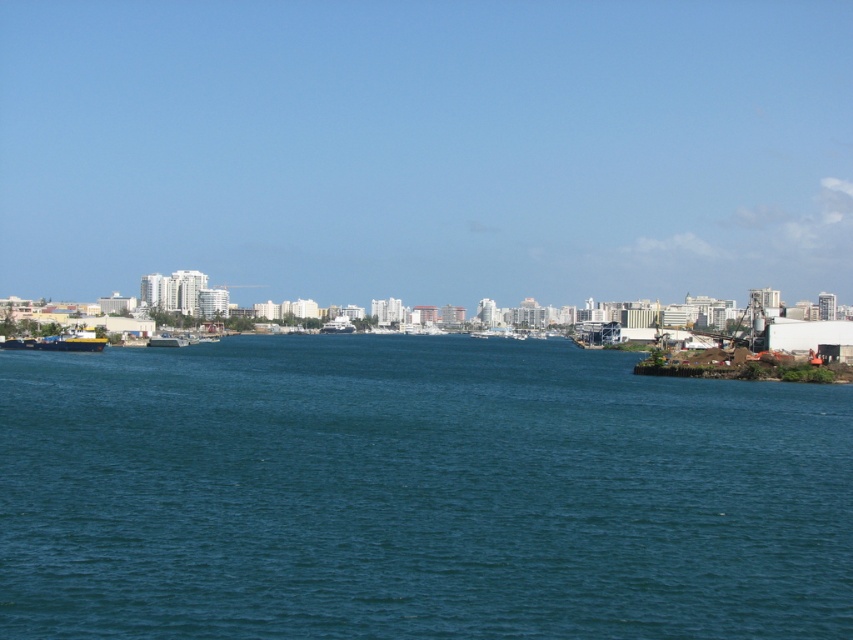
You are standing at the edge of the dock looking out at the bay. There are two points marked on the water surface in front of you. The first point is at coordinates point (30, 522) and the second is at point (163, 342). Which point is closer to your current position?

Point (30, 522) is closer to the camera than point (163, 342), so the first point is closer to your current position.

You are a photographer planning to capture the entire view of the teal water at center and the metallic gray boat at left in one shot. Based on their sizes, which object will occupy more of the frame?

The teal water at center occupies more of the frame because it is larger in size than the metallic gray boat at left.